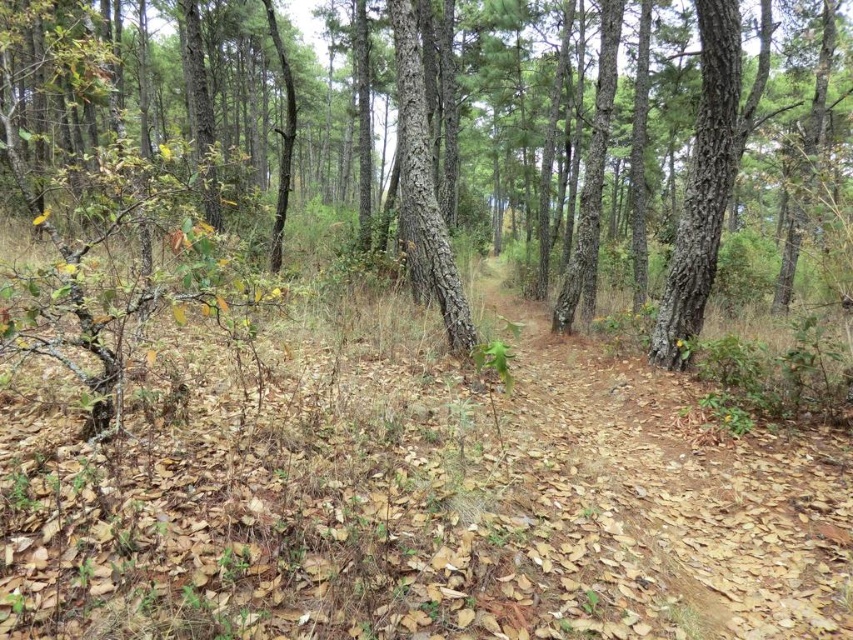
Question: Considering the relative positions of brown rough tree at center and smooth bark tree at right in the image provided, where is brown rough tree at center located with respect to smooth bark tree at right?

Choices:
 (A) below
 (B) above

Answer: (B)

Question: Which point is closer to the camera?

Choices:
 (A) (90, 156)
 (B) (462, 301)
 (C) (711, 106)

Answer: (A)

Question: Which object is the farthest from the smooth bark tree at right?

Choices:
 (A) smooth bark tree at center
 (B) brown rough tree at center

Answer: (B)

Question: Which point is farther to the camera?

Choices:
 (A) (672, 275)
 (B) (426, 157)

Answer: (A)

Question: Does brown rough tree at center appear on the left side of smooth bark tree at right?

Choices:
 (A) yes
 (B) no

Answer: (A)

Question: Observing the image, what is the correct spatial positioning of smooth bark tree at right in reference to smooth bark tree at center?

Choices:
 (A) left
 (B) right

Answer: (B)